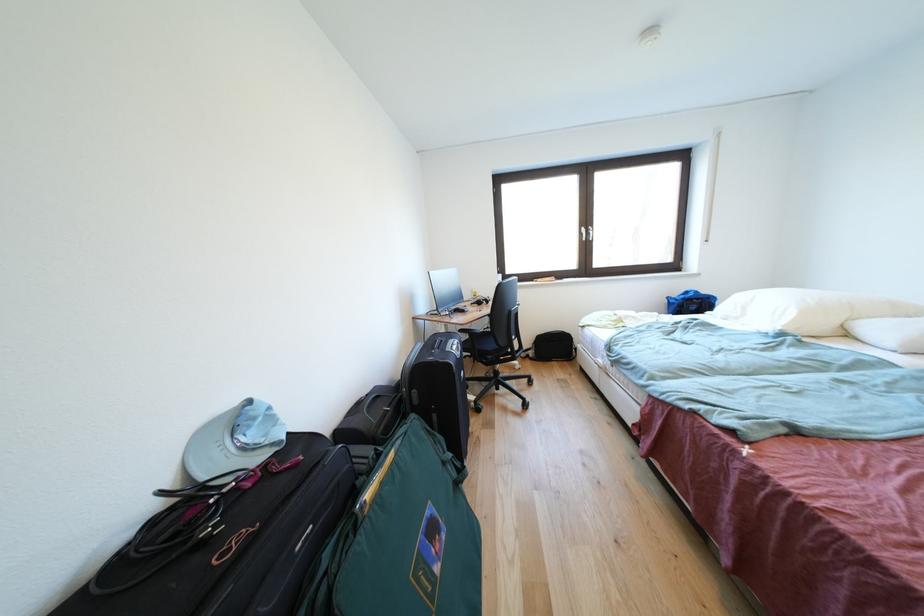
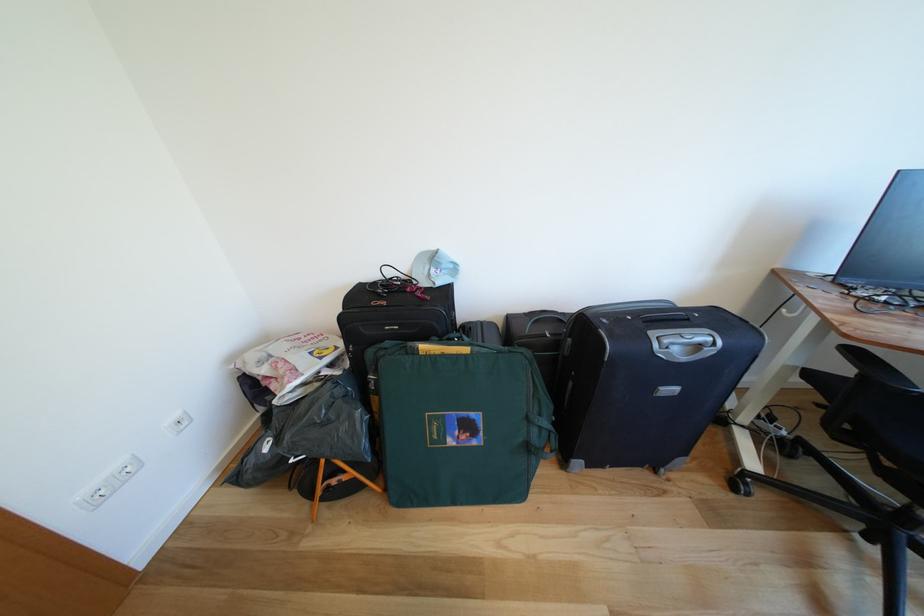
Where in the second image is the point corresponding to [453,456] from the first image?

(548, 419)